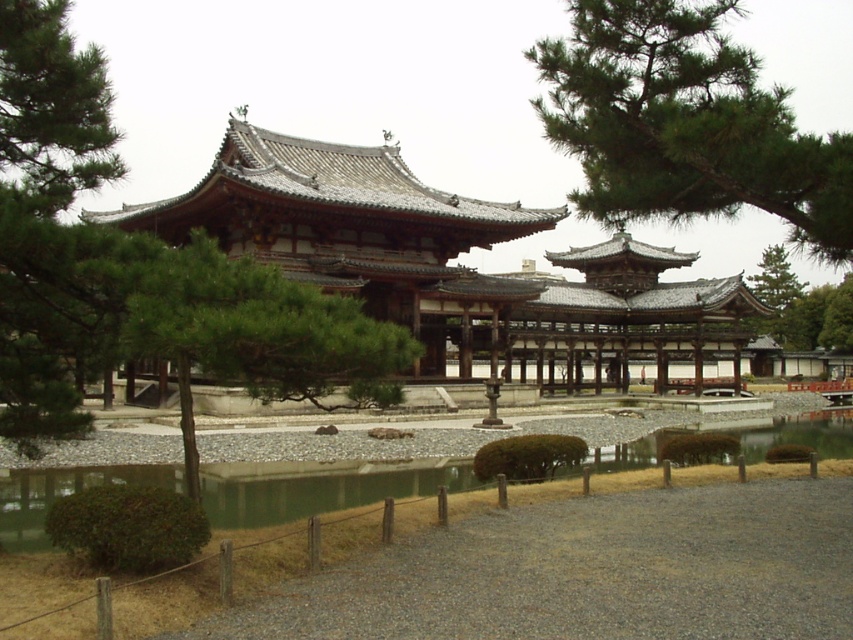
You are a visitor in the Japanese garden and want to take a photo of the green textured tree at center and the green water at center. Which object will appear closer to the camera in your photo?

The green textured tree at center will appear closer to the camera in your photo because it is positioned in front of the green water at center.

You are a visitor in the Japanese garden and want to take a photo of both the green textured tree at center and the green water at center. Which object will appear smaller in your photo?

The green textured tree at center will appear smaller in the photo because it occupies less space than the green water at center.